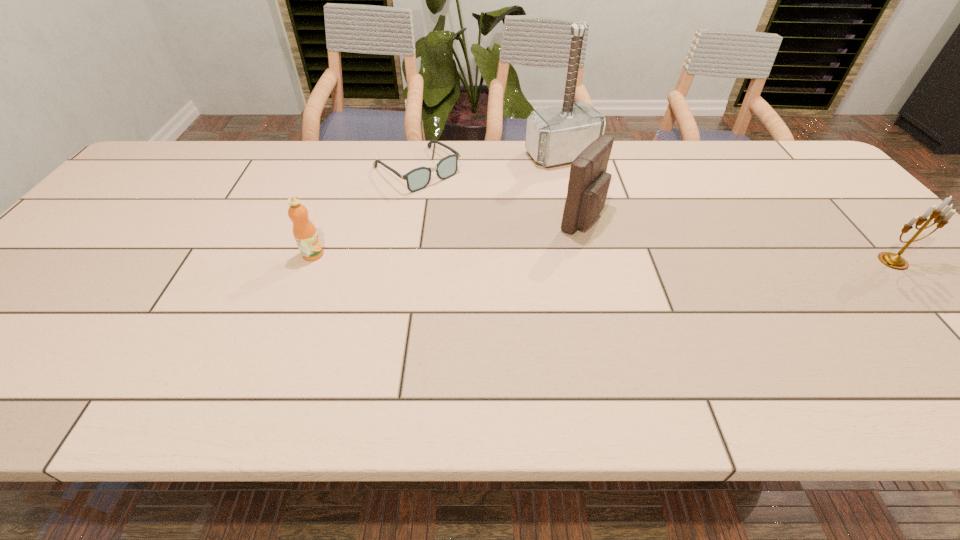
Image resolution: width=960 pixels, height=540 pixels. I want to click on object present at the right edge, so click(895, 261).

I want to click on free region at the far edge, so click(x=189, y=177).

Where is `vacant space at the near edge of the desktop`? The image size is (960, 540). vacant space at the near edge of the desktop is located at coordinates (719, 357).

I want to click on vacant area at the left edge of the desktop, so 103,234.

Where is `vacant space at the right edge of the desktop`? The height and width of the screenshot is (540, 960). vacant space at the right edge of the desktop is located at coordinates (836, 224).

Where is `blank area at the near left corner`? This screenshot has width=960, height=540. blank area at the near left corner is located at coordinates (36, 357).

The image size is (960, 540). I want to click on free point between the candelabrum and the leftmost object, so click(x=603, y=258).

The image size is (960, 540). I want to click on vacant area that lies between the shortest object and the tallest object, so click(490, 163).

Identify the location of free area in between the hammer and the candelabrum. (727, 208).

This screenshot has height=540, width=960. In order to click on free space between the second object from left to right and the tallest object in this screenshot , I will do `click(490, 163)`.